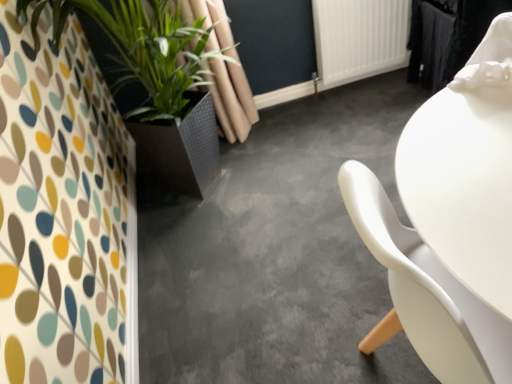
Describe the element at coordinates (359, 38) in the screenshot. The image size is (512, 384). I see `white plastic radiator at upper center` at that location.

The width and height of the screenshot is (512, 384). What do you see at coordinates (154, 76) in the screenshot?
I see `green leafy plant at left` at bounding box center [154, 76].

Find the location of `white plastic radiator at upper center`. white plastic radiator at upper center is located at coordinates (x=359, y=38).

Does white plastic radiator at upper center come behind green leafy plant at left?

Yes.

Who is shorter, white plastic radiator at upper center or green leafy plant at left?

white plastic radiator at upper center is shorter.

Considering the relative sizes of white plastic radiator at upper center and green leafy plant at left in the image provided, is white plastic radiator at upper center smaller than green leafy plant at left?

Yes.

Does point (359, 60) appear closer or farther from the camera than point (168, 21)?

Point (359, 60) appears to be farther away from the viewer than point (168, 21).

In terms of height, does concretesmoothfloor at center look taller or shorter compared to green leafy plant at left?

Clearly, concretesmoothfloor at center is shorter compared to green leafy plant at left.

Does concretesmoothfloor at center have a greater width compared to green leafy plant at left?

Correct, the width of concretesmoothfloor at center exceeds that of green leafy plant at left.

From a real-world perspective, is concretesmoothfloor at center above or below green leafy plant at left?

In terms of real-world spatial position, concretesmoothfloor at center is below green leafy plant at left.

Choose the correct answer: Is concretesmoothfloor at center inside green leafy plant at left or outside it?

concretesmoothfloor at center lies outside green leafy plant at left.

Between concretesmoothfloor at center and white plastic radiator at upper center, which one has smaller size?

white plastic radiator at upper center.

Is concretesmoothfloor at center positioned with its back to white plastic radiator at upper center?

That's not correct — concretesmoothfloor at center is not looking away from white plastic radiator at upper center.

From a real-world perspective, is concretesmoothfloor at center over white plastic radiator at upper center?

Incorrect, from a real-world perspective, concretesmoothfloor at center is lower than white plastic radiator at upper center.

Which is in front, concretesmoothfloor at center or white plastic radiator at upper center?

concretesmoothfloor at center.

Visually, is green leafy plant at left positioned to the left or to the right of white plastic radiator at upper center?

In the image, green leafy plant at left appears on the left side of white plastic radiator at upper center.

Is green leafy plant at left oriented away from white plastic radiator at upper center?

No, green leafy plant at left's orientation is not away from white plastic radiator at upper center.

The width and height of the screenshot is (512, 384). What are the coordinates of `radiator behind the green leafy plant at left` in the screenshot? It's located at (359, 38).

Is green leafy plant at left in contact with white plastic radiator at upper center?

They are not placed beside each other.

Is white plastic radiator at upper center to the left of concretesmoothfloor at center from the viewer's perspective?

In fact, white plastic radiator at upper center is to the right of concretesmoothfloor at center.

Find the location of a particular element. The width and height of the screenshot is (512, 384). radiator above the concretesmoothfloor at center (from a real-world perspective) is located at coordinates (359, 38).

Could you tell me if white plastic radiator at upper center is facing concretesmoothfloor at center?

Yes.

Which is behind, point (321, 55) or point (347, 377)?

Point (321, 55)

Is point (209, 116) farther from viewer compared to point (358, 148)?

No, (209, 116) is closer to viewer.

Is concretesmoothfloor at center a part of green leafy plant at left?

No.

In the image, there is a green leafy plant at left. At what (x,y) coordinates should I click in order to perform the action: click on concrete below it (from the image's perspective). Please return your answer as a coordinate pair (x, y). This screenshot has height=384, width=512. Looking at the image, I should click on (279, 254).

You are a GUI agent. You are given a task and a screenshot of the screen. Output one action in this format:
    pyautogui.click(x=<x>, y=<y>)
    Task: Click on the houseplant in front of the white plastic radiator at upper center
    The image size is (512, 384).
    Given the screenshot: What is the action you would take?
    click(154, 76)

Locate an element on the screen. The width and height of the screenshot is (512, 384). concrete that is below the green leafy plant at left (from the image's perspective) is located at coordinates (279, 254).

Estimate the real-world distances between objects in this image. Which object is closer to white plastic radiator at upper center, green leafy plant at left or concretesmoothfloor at center?

concretesmoothfloor at center.

Looking at the image, which one is located further to green leafy plant at left, concretesmoothfloor at center or white plastic radiator at upper center?

The object further to green leafy plant at left is white plastic radiator at upper center.

Which object lies nearer to the anchor point white plastic radiator at upper center, concretesmoothfloor at center or green leafy plant at left?

concretesmoothfloor at center lies closer to white plastic radiator at upper center than the other object.

Estimate the real-world distances between objects in this image. Which object is closer to green leafy plant at left, white plastic radiator at upper center or concretesmoothfloor at center?

Based on the image, concretesmoothfloor at center appears to be nearer to green leafy plant at left.

Considering their positions, is white plastic radiator at upper center positioned further to concretesmoothfloor at center than green leafy plant at left?

Based on the image, white plastic radiator at upper center appears to be further to concretesmoothfloor at center.

Which object lies nearer to the anchor point concretesmoothfloor at center, green leafy plant at left or white plastic radiator at upper center?

Among the two, green leafy plant at left is located nearer to concretesmoothfloor at center.

This screenshot has width=512, height=384. I want to click on houseplant located between concretesmoothfloor at center and white plastic radiator at upper center in the depth direction, so click(154, 76).